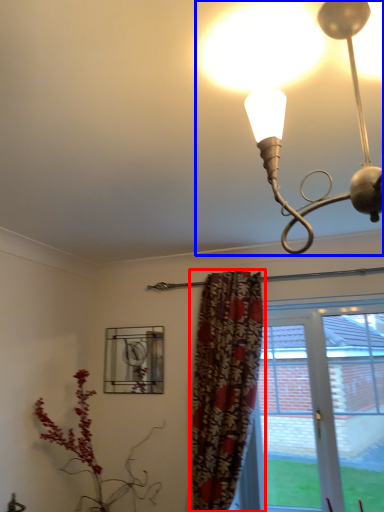
Question: Which point is closer to the camera, curtain (highlighted by a red box) or lamp (highlighted by a blue box)?

Choices:
 (A) curtain
 (B) lamp

Answer: (B)